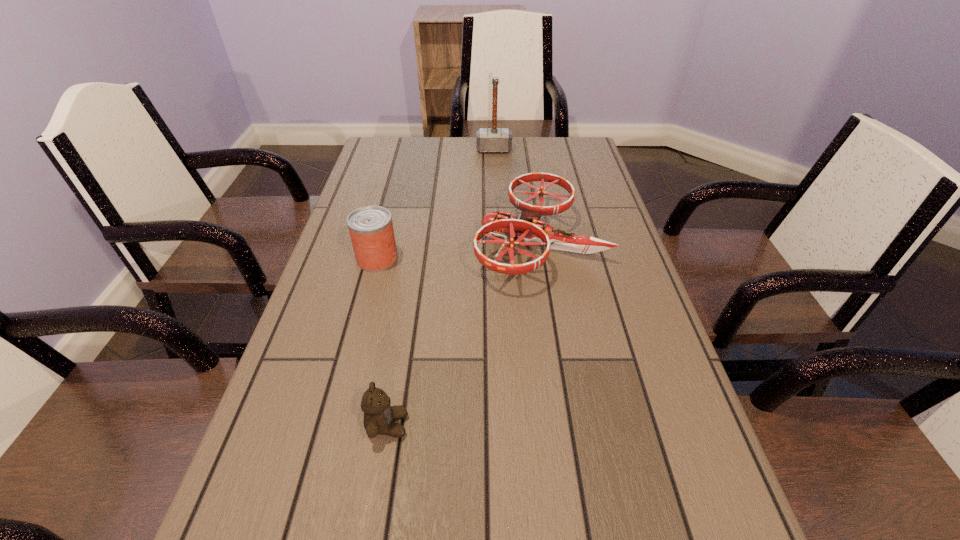
This screenshot has height=540, width=960. What are the coordinates of `free space between the drone and the hammer` in the screenshot? It's located at (516, 197).

This screenshot has width=960, height=540. Identify the location of free point between the nearest object and the drone. (464, 334).

I want to click on empty location between the hammer and the second tallest object, so pos(436,204).

Find the location of a particular element. free spot between the leftmost object and the teddy bear is located at coordinates (382, 342).

Locate an element on the screen. This screenshot has width=960, height=540. vacant point located between the hammer and the drone is located at coordinates (516, 197).

Image resolution: width=960 pixels, height=540 pixels. Identify the location of free space between the hammer and the can. (436, 204).

Locate an element on the screen. Image resolution: width=960 pixels, height=540 pixels. vacant region between the tallest object and the second object from left to right is located at coordinates (441, 287).

Where is `blank region between the teddy bear and the tallest object`? The height and width of the screenshot is (540, 960). blank region between the teddy bear and the tallest object is located at coordinates (441, 287).

Identify which object is located as the nearest to the hammer. Please provide its 2D coordinates. Your answer should be formatted as a tuple, i.e. [(x, y)], where the tuple contains the x and y coordinates of a point satisfying the conditions above.

[(529, 228)]

Locate an element on the screen. The image size is (960, 540). the third closest object relative to the hammer is located at coordinates (379, 416).